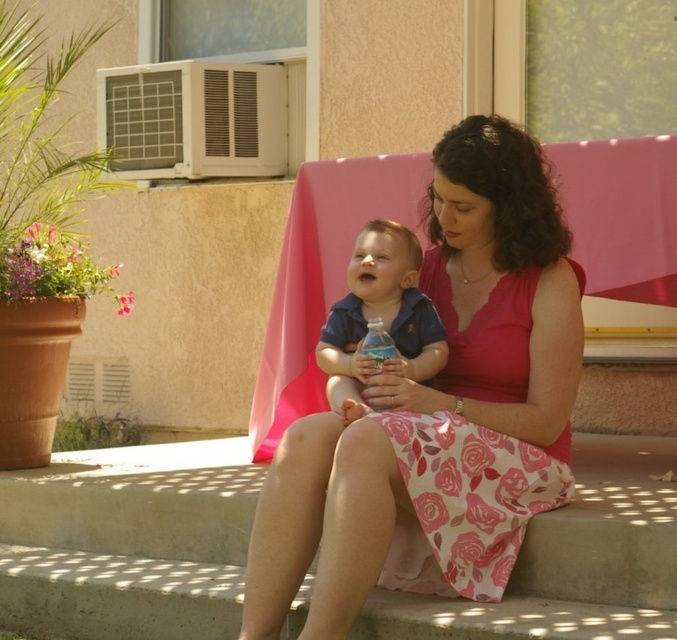
Who is higher up, pink floral dress at center or translucent plastic water bottle at center?

translucent plastic water bottle at center

Where is `pink floral dress at center`? Image resolution: width=677 pixels, height=640 pixels. pink floral dress at center is located at coordinates (439, 410).

Find the location of a particular element. This screenshot has width=677, height=640. pink floral dress at center is located at coordinates (439, 410).

Can you confirm if pink floral dress at center is positioned to the left of pink fabric skirt at lower center?

Incorrect, pink floral dress at center is not on the left side of pink fabric skirt at lower center.

Between pink floral dress at center and pink fabric skirt at lower center, which one has less height?

Standing shorter between the two is pink fabric skirt at lower center.

Is point (380, 512) closer to camera compared to point (70, 516)?

Yes.

Find the location of a particular element. This screenshot has height=640, width=677. pink floral dress at center is located at coordinates (439, 410).

Can you confirm if pink floral dress at center is bigger than pink floral fabric dress at center?

Correct, pink floral dress at center is larger in size than pink floral fabric dress at center.

Who is positioned more to the left, pink floral dress at center or pink floral fabric dress at center?

pink floral dress at center is more to the left.

Which is behind, point (280, 608) or point (468, 348)?

Point (468, 348)

Where is `pink floral dress at center`? pink floral dress at center is located at coordinates (439, 410).